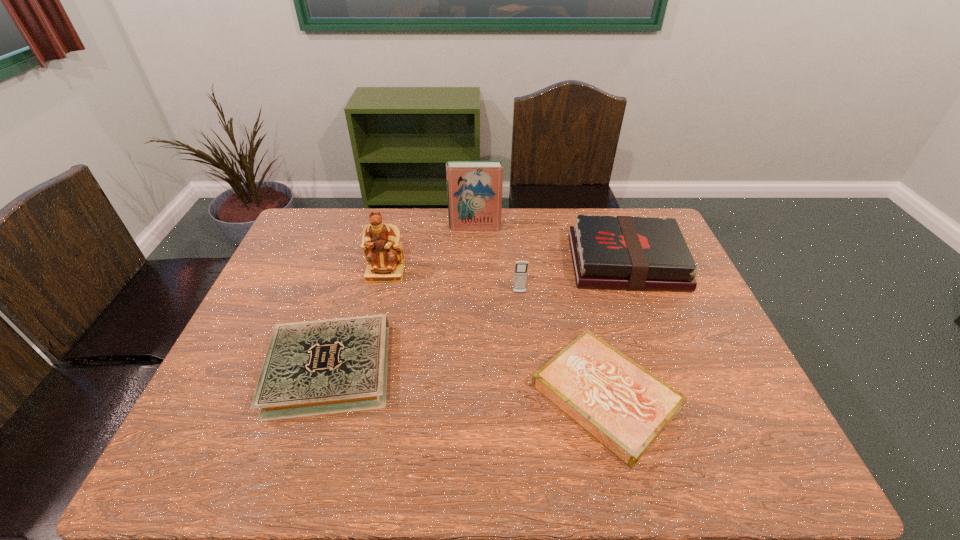
In the image, there is a desktop. Find the location of `free region at the left edge`. free region at the left edge is located at coordinates 215,400.

In the image, there is a desktop. What are the coordinates of `free region at the right edge` in the screenshot? It's located at (698, 400).

Where is `vacant space at the far left corner of the desktop`? The image size is (960, 540). vacant space at the far left corner of the desktop is located at coordinates (312, 241).

This screenshot has height=540, width=960. In the image, there is a desktop. Find the location of `vacant space at the near left corner`. vacant space at the near left corner is located at coordinates (207, 473).

I want to click on free area in between the fourth shortest object and the third nearest hardback book, so click(573, 278).

The height and width of the screenshot is (540, 960). What are the coordinates of `free space that is in between the shortest object and the figurine` in the screenshot? It's located at (495, 334).

Locate an element on the screen. The image size is (960, 540). free space between the fourth tallest object and the leftmost hardback book is located at coordinates (478, 316).

Where is `vacant space in between the farthest hardback book and the figurine`? The width and height of the screenshot is (960, 540). vacant space in between the farthest hardback book and the figurine is located at coordinates (430, 250).

Where is `free space between the cellular telephone and the shortest object`? The height and width of the screenshot is (540, 960). free space between the cellular telephone and the shortest object is located at coordinates tap(563, 345).

Where is `vacant area that lies between the figurine and the shortest hardback book`? The width and height of the screenshot is (960, 540). vacant area that lies between the figurine and the shortest hardback book is located at coordinates (495, 334).